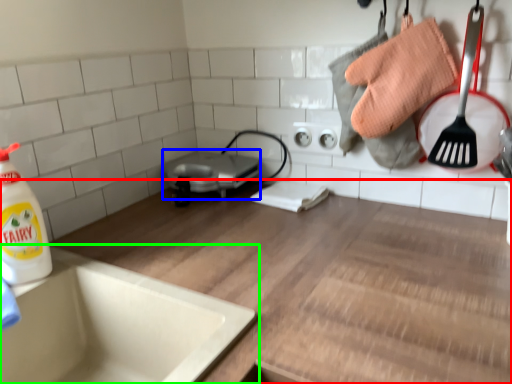
Question: Considering the real-world distances, which object is farthest from countertop (highlighted by a red box)? appliance (highlighted by a blue box) or sink (highlighted by a green box)?

Choices:
 (A) appliance
 (B) sink

Answer: (A)